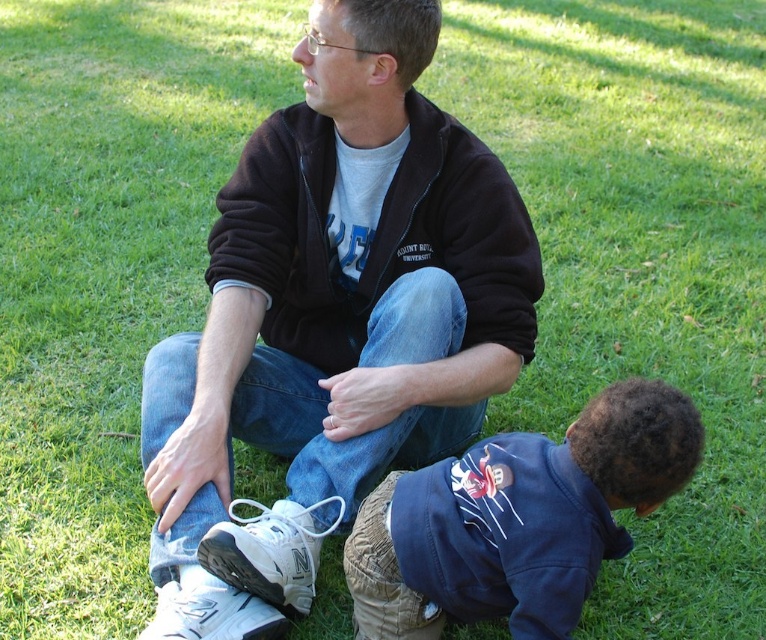
Question: Is matte black jacket at center below dark blue fleece at lower right?

Choices:
 (A) yes
 (B) no

Answer: (B)

Question: Which object is farther from the camera taking this photo?

Choices:
 (A) dark blue fleece at lower right
 (B) black fleece sweatshirt at center
 (C) matte black jacket at center

Answer: (B)

Question: Estimate the real-world distances between objects in this image. Which object is farther from the black fleece sweatshirt at center?

Choices:
 (A) dark blue fleece at lower right
 (B) matte black jacket at center

Answer: (A)

Question: In this image, where is matte black jacket at center located relative to black fleece sweatshirt at center?

Choices:
 (A) right
 (B) left

Answer: (B)

Question: Which of the following is the closest to the observer?

Choices:
 (A) black fleece sweatshirt at center
 (B) matte black jacket at center
 (C) dark blue fleece at lower right

Answer: (C)

Question: Can you confirm if matte black jacket at center is positioned to the right of dark blue fleece at lower right?

Choices:
 (A) no
 (B) yes

Answer: (A)